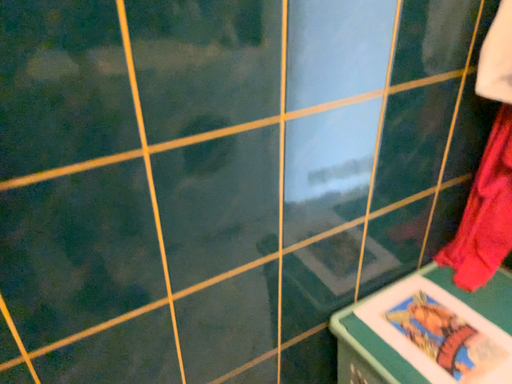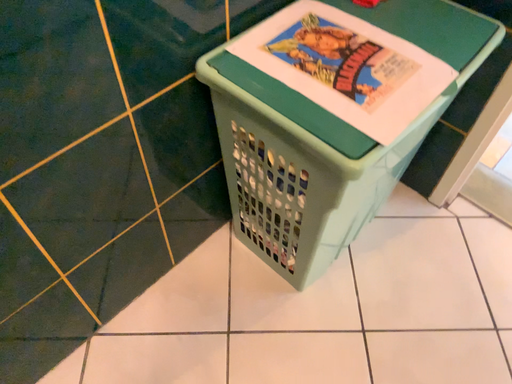
Question: Which way did the camera rotate in the video?

Choices:
 (A) rotated upward
 (B) rotated downward

Answer: (B)